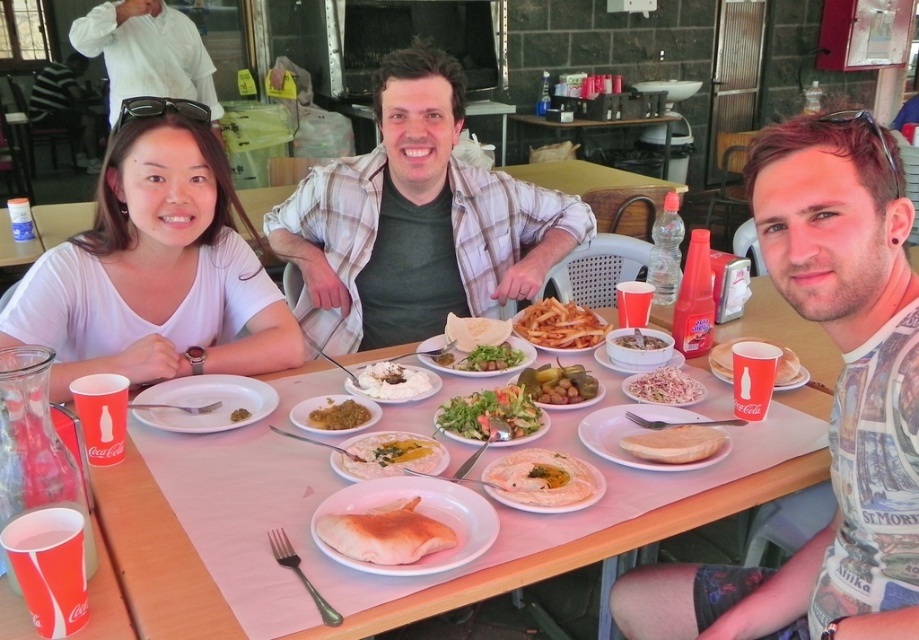
Can you confirm if plaid shirt at center is positioned to the left of green glossy olives at center?

Indeed, plaid shirt at center is positioned on the left side of green glossy olives at center.

Find the location of a particular element. Image resolution: width=919 pixels, height=640 pixels. plaid shirt at center is located at coordinates (420, 216).

Between fresh green salad at center and golden crispy fries at center, which one is positioned lower?

fresh green salad at center

Is the position of fresh green salad at center more distant than that of golden crispy fries at center?

That is False.

Where is `fresh green salad at center`? fresh green salad at center is located at coordinates [488, 413].

Does green leafy salad at center appear over yellowish paste at center?

Correct, green leafy salad at center is located above yellowish paste at center.

Is green leafy salad at center further to camera compared to yellowish paste at center?

Yes.

Find the location of a particular element. The image size is (919, 640). green leafy salad at center is located at coordinates (490, 358).